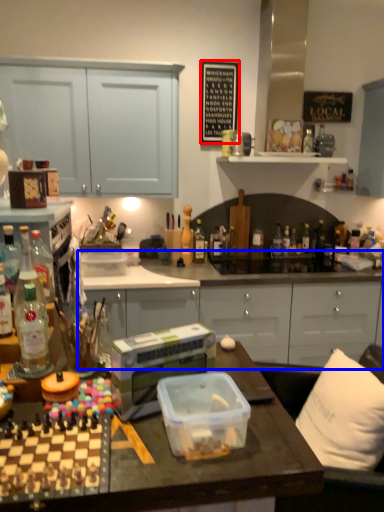
Question: Which point is further to the camera, bulletin board (highlighted by a red box) or cabinetry (highlighted by a blue box)?

Choices:
 (A) bulletin board
 (B) cabinetry

Answer: (A)